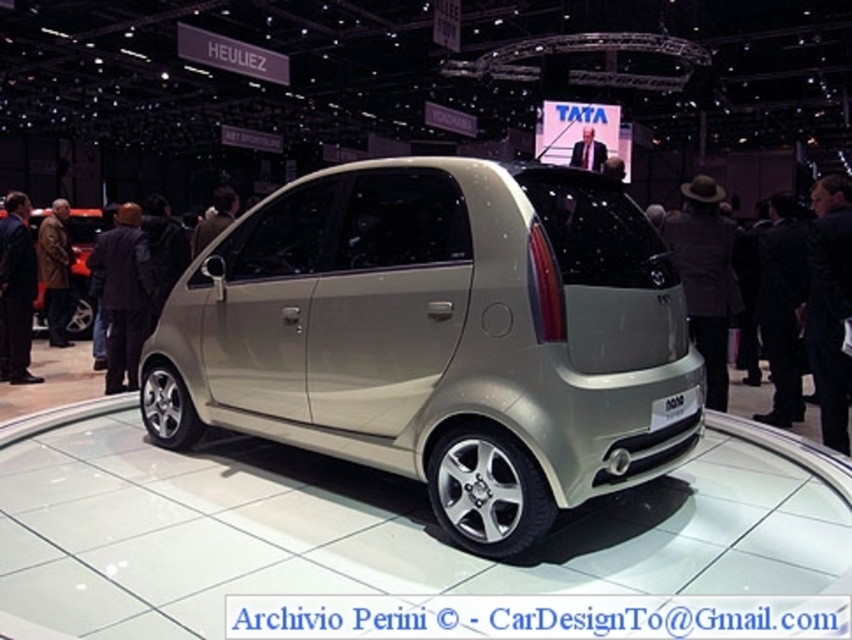
Can you confirm if satin beige minivan at center is positioned below matte silver car at left?

Correct, satin beige minivan at center is located below matte silver car at left.

Can you confirm if satin beige minivan at center is thinner than matte silver car at left?

No.

Between point (330, 292) and point (87, 250), which one is positioned in front?

Point (330, 292) is in front.

The image size is (852, 640). Identify the location of satin beige minivan at center. (440, 337).